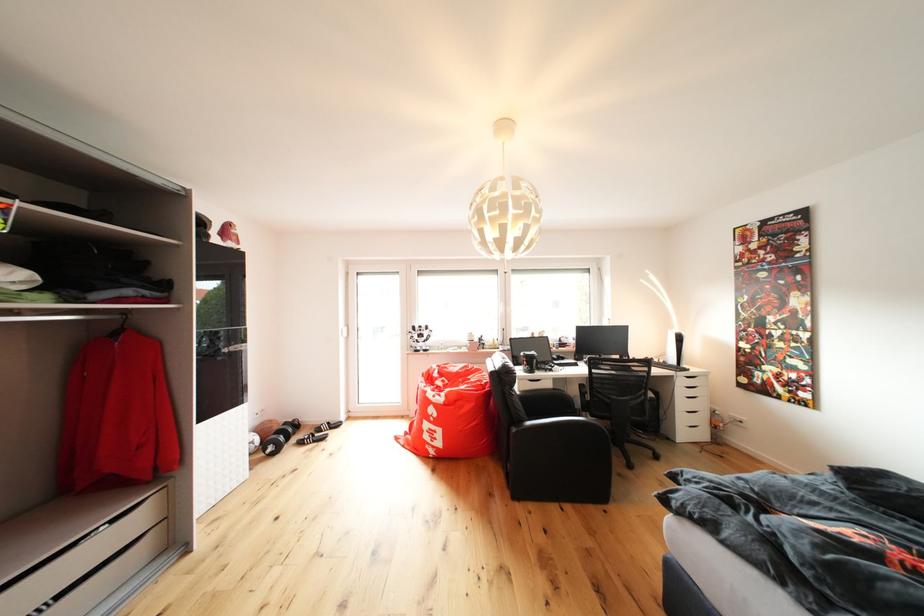
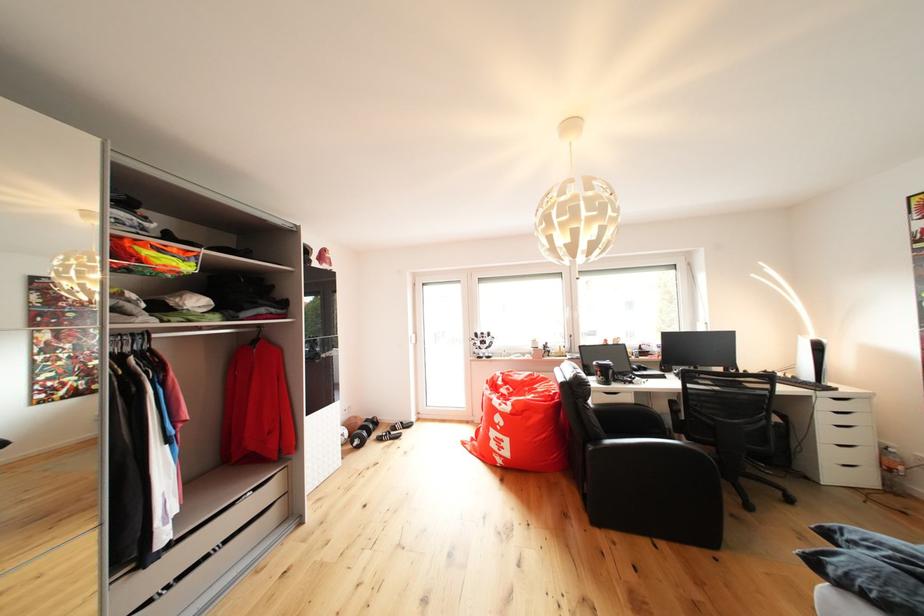
The point at (535, 361) is marked in the first image. Where is the corresponding point in the second image?

(609, 371)